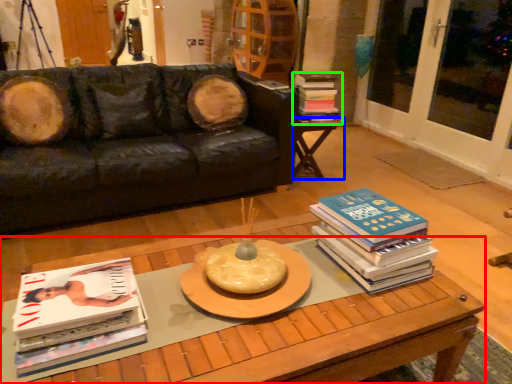
Question: Which object is positioned closest to coffee table (highlighted by a red box)? Select from table (highlighted by a blue box) and book (highlighted by a green box).

Choices:
 (A) table
 (B) book

Answer: (A)